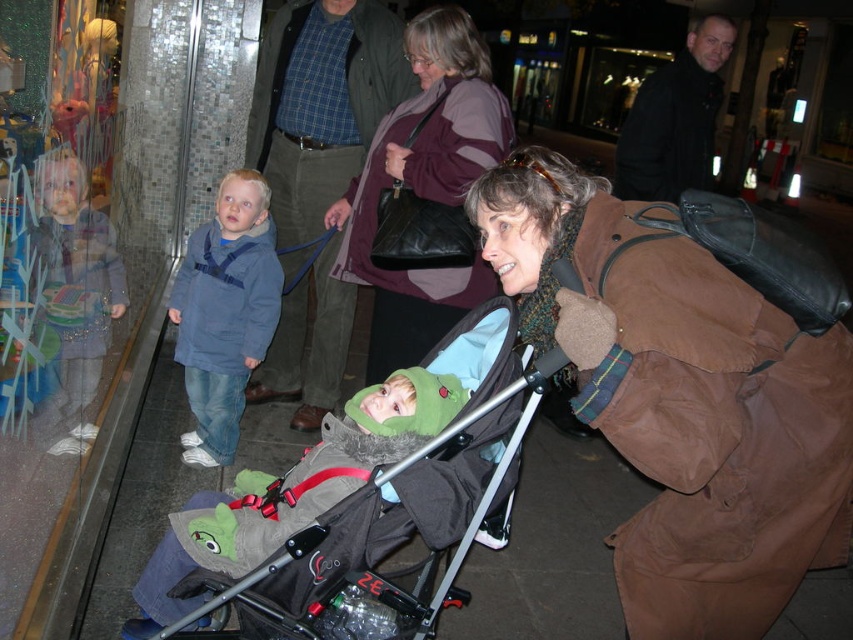
You are a photographer standing at the camera position. You want to take a photo that includes both the point at (770, 518) and the point at (173, 634). Which point will appear larger in the photo?

Point at (770, 518) will appear larger in the photo because it is closer to the camera than point at (173, 634).

You are a photographer aiming to capture the brown fabric coat at center and the dark gray fabric stroller at center in a single frame. Based on their positions, which object should you position closer to the left side of your camera viewfinder to ensure both are fully visible?

To ensure both the brown fabric coat at center and the dark gray fabric stroller at center are fully visible in the frame, position the dark gray fabric stroller at center closer to the left side of the camera viewfinder since the brown fabric coat at center is already to the right of it.

You are a photographer taking a picture of the brown fabric coat at center and the dark gray fabric stroller at center. Which object will appear larger in the photo?

The brown fabric coat at center will appear larger in the photo because it is closer to the viewer than the dark gray fabric stroller at center.